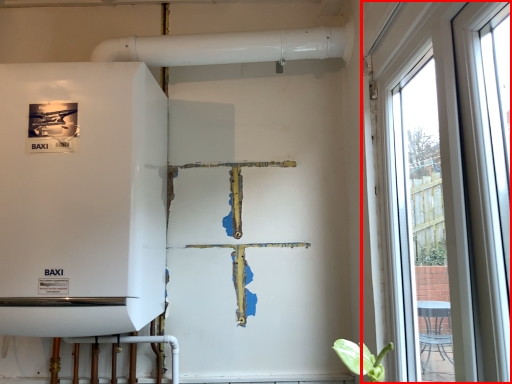
Question: From the image's perspective, what is the correct spatial positioning of window (annotated by the red box) in reference to appliance?

Choices:
 (A) below
 (B) above

Answer: (A)